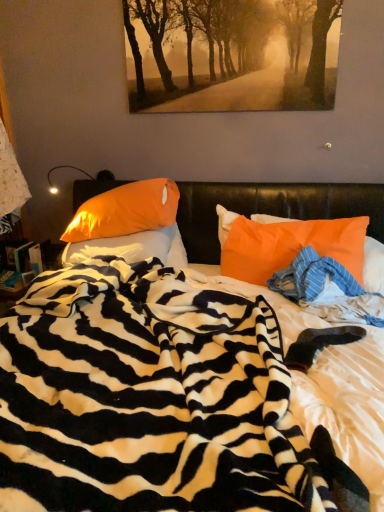
In order to face zebra-patterned blanket at center, should I rotate leftwards or rightwards?

Turn left by 2.061 degrees to look at zebra-patterned blanket at center.

What is the approximate width of golden textured pathway at upper center?

2.22 inches.

Describe the element at coordinates (312, 277) in the screenshot. I see `blue striped fabric at center` at that location.

What is the approximate height of orange satin pillow at center, arranged as the first pillow when viewed from the left?

orange satin pillow at center, arranged as the first pillow when viewed from the left, is 9.42 inches tall.

You are a GUI agent. You are given a task and a screenshot of the screen. Output one action in this format:
    pyautogui.click(x=<x>, y=<y>)
    Task: Click on the orange satin pillow at center, arranged as the first pillow when viewed from the left
    Image resolution: width=384 pixels, height=512 pixels.
    Given the screenshot: What is the action you would take?
    pyautogui.click(x=132, y=248)

At what (x,y) coordinates should I click in order to perform the action: click on zebra-patterned blanket at center. Please return your answer as a coordinate pair (x, y). This screenshot has height=512, width=384. Looking at the image, I should click on (150, 397).

From a real-world perspective, which object stands above the other?

golden textured pathway at upper center.

Is golden textured pathway at upper center smaller than orange fabric pillow at right, which is counted as the third pillow, starting from the left?

Yes, golden textured pathway at upper center is smaller than orange fabric pillow at right, which is counted as the third pillow, starting from the left.

Can you confirm if golden textured pathway at upper center is taller than orange fabric pillow at right, which is counted as the third pillow, starting from the left?

Yes, golden textured pathway at upper center is taller than orange fabric pillow at right, which is counted as the third pillow, starting from the left.

Is golden textured pathway at upper center far from orange fabric pillow at right, acting as the 1th pillow starting from the right?

golden textured pathway at upper center is actually quite close to orange fabric pillow at right, acting as the 1th pillow starting from the right.

Does orange satin pillow at center, which appears as the 3th pillow when viewed from the right, appear on the left side of orange fabric pillow at left, arranged as the 2th pillow when viewed from the left?

Correct, you'll find orange satin pillow at center, which appears as the 3th pillow when viewed from the right, to the left of orange fabric pillow at left, arranged as the 2th pillow when viewed from the left.

Is orange satin pillow at center, which appears as the 3th pillow when viewed from the right, turned away from orange fabric pillow at left, positioned as the 2th pillow in right-to-left order?

orange satin pillow at center, which appears as the 3th pillow when viewed from the right, is not turned away from orange fabric pillow at left, positioned as the 2th pillow in right-to-left order.

Considering the relative positions of orange satin pillow at center, which appears as the 3th pillow when viewed from the right, and orange fabric pillow at left, positioned as the 2th pillow in right-to-left order, in the image provided, is orange satin pillow at center, which appears as the 3th pillow when viewed from the right, in front of orange fabric pillow at left, positioned as the 2th pillow in right-to-left order,?

Yes, orange satin pillow at center, which appears as the 3th pillow when viewed from the right, is closer to the viewer.

Locate an element on the screen. This screenshot has width=384, height=512. pillow that is the 2nd one when counting downward from the orange fabric pillow at left, arranged as the 2th pillow when viewed from the left (from the image's perspective) is located at coordinates (287, 244).

Based on the photo, from the image's perspective, does orange fabric pillow at right, which is counted as the third pillow, starting from the left, appear lower than orange fabric pillow at left, arranged as the 2th pillow when viewed from the left?

Yes, from the image's perspective, orange fabric pillow at right, which is counted as the third pillow, starting from the left, is below orange fabric pillow at left, arranged as the 2th pillow when viewed from the left.

Is orange fabric pillow at right, acting as the 1th pillow starting from the right, thinner than orange fabric pillow at left, arranged as the 2th pillow when viewed from the left?

Indeed, orange fabric pillow at right, acting as the 1th pillow starting from the right, has a lesser width compared to orange fabric pillow at left, arranged as the 2th pillow when viewed from the left.

From a real-world perspective, relative to orange fabric pillow at left, positioned as the 2th pillow in right-to-left order, is orange fabric pillow at right, which is counted as the third pillow, starting from the left, vertically above or below?

orange fabric pillow at right, which is counted as the third pillow, starting from the left, is below orange fabric pillow at left, positioned as the 2th pillow in right-to-left order.

In the scene shown: Is orange fabric pillow at left, positioned as the 2th pillow in right-to-left order, aimed at zebra-patterned blanket at center?

Yes, orange fabric pillow at left, positioned as the 2th pillow in right-to-left order, is turned towards zebra-patterned blanket at center.

From the image's perspective, which is below, orange fabric pillow at left, positioned as the 2th pillow in right-to-left order, or zebra-patterned blanket at center?

zebra-patterned blanket at center is shown below in the image.

Considering the relative positions of orange fabric pillow at left, arranged as the 2th pillow when viewed from the left, and zebra-patterned blanket at center in the image provided, is orange fabric pillow at left, arranged as the 2th pillow when viewed from the left, to the right of zebra-patterned blanket at center from the viewer's perspective?

In fact, orange fabric pillow at left, arranged as the 2th pillow when viewed from the left, is to the left of zebra-patterned blanket at center.

Could you measure the distance between orange fabric pillow at right, acting as the 1th pillow starting from the right, and orange satin pillow at center, arranged as the first pillow when viewed from the left?

A distance of 21.77 inches exists between orange fabric pillow at right, acting as the 1th pillow starting from the right, and orange satin pillow at center, arranged as the first pillow when viewed from the left.

Looking at this image, how different are the orientations of orange fabric pillow at right, acting as the 1th pillow starting from the right, and orange satin pillow at center, which appears as the 3th pillow when viewed from the right, in degrees?

There is a 0.000985-degree angle between the facing directions of orange fabric pillow at right, acting as the 1th pillow starting from the right, and orange satin pillow at center, which appears as the 3th pillow when viewed from the right.

Is the surface of orange fabric pillow at right, acting as the 1th pillow starting from the right, in direct contact with orange satin pillow at center, arranged as the first pillow when viewed from the left?

orange fabric pillow at right, acting as the 1th pillow starting from the right, and orange satin pillow at center, arranged as the first pillow when viewed from the left, are clearly separated.

From their relative heights in the image, would you say orange fabric pillow at right, which is counted as the third pillow, starting from the left, is taller or shorter than orange satin pillow at center, which appears as the 3th pillow when viewed from the right?

In the image, orange fabric pillow at right, which is counted as the third pillow, starting from the left, appears to be taller than orange satin pillow at center, which appears as the 3th pillow when viewed from the right.

From a real-world perspective, between golden textured pathway at upper center and blue striped fabric at center, who is vertically higher?

golden textured pathway at upper center is physically above.

Looking at this image, can you confirm if golden textured pathway at upper center is positioned to the left of blue striped fabric at center?

Indeed, golden textured pathway at upper center is positioned on the left side of blue striped fabric at center.

Does golden textured pathway at upper center turn towards blue striped fabric at center?

No, golden textured pathway at upper center is not facing towards blue striped fabric at center.

Is orange satin pillow at center, which appears as the 3th pillow when viewed from the right, wider than zebra-patterned blanket at center?

Incorrect, the width of orange satin pillow at center, which appears as the 3th pillow when viewed from the right, does not surpass that of zebra-patterned blanket at center.

Find the location of a particular element. bed that is on the right side of orange satin pillow at center, arranged as the first pillow when viewed from the left is located at coordinates (150, 397).

Does point (161, 249) appear closer or farther from the camera than point (189, 301)?

Point (161, 249) is farther from the camera than point (189, 301).

In terms of height, does orange satin pillow at center, arranged as the first pillow when viewed from the left, look taller or shorter compared to zebra-patterned blanket at center?

In the image, orange satin pillow at center, arranged as the first pillow when viewed from the left, appears to be shorter than zebra-patterned blanket at center.

You are a GUI agent. You are given a task and a screenshot of the screen. Output one action in this format:
    pyautogui.click(x=<x>, y=<y>)
    Task: Click on the pillow that appears on the right of golden textured pathway at upper center
    
    Given the screenshot: What is the action you would take?
    pyautogui.click(x=287, y=244)

Where is `the 1st pillow in front of the orange fabric pillow at left, arranged as the 2th pillow when viewed from the left`? the 1st pillow in front of the orange fabric pillow at left, arranged as the 2th pillow when viewed from the left is located at coordinates (132, 248).

From the image, which object appears to be farther from golden textured pathway at upper center, zebra-patterned blanket at center or blue striped fabric at center?

Based on the image, zebra-patterned blanket at center appears to be further to golden textured pathway at upper center.

Which object lies nearer to the anchor point golden textured pathway at upper center, blue striped fabric at center or zebra-patterned blanket at center?

Among the two, blue striped fabric at center is located nearer to golden textured pathway at upper center.

Estimate the real-world distances between objects in this image. Which object is further from blue striped fabric at center, orange satin pillow at center, arranged as the first pillow when viewed from the left, or golden textured pathway at upper center?

golden textured pathway at upper center.

Looking at the image, which one is located closer to zebra-patterned blanket at center, orange satin pillow at center, arranged as the first pillow when viewed from the left, or golden textured pathway at upper center?

orange satin pillow at center, arranged as the first pillow when viewed from the left, is closer to zebra-patterned blanket at center.

Estimate the real-world distances between objects in this image. Which object is closer to orange fabric pillow at left, arranged as the 2th pillow when viewed from the left, orange satin pillow at center, arranged as the first pillow when viewed from the left, or orange fabric pillow at right, acting as the 1th pillow starting from the right?

orange satin pillow at center, arranged as the first pillow when viewed from the left, is positioned closer to the anchor orange fabric pillow at left, arranged as the 2th pillow when viewed from the left.

From the image, which object appears to be farther from golden textured pathway at upper center, orange fabric pillow at left, positioned as the 2th pillow in right-to-left order, or zebra-patterned blanket at center?

Based on the image, zebra-patterned blanket at center appears to be further to golden textured pathway at upper center.

When comparing their distances from zebra-patterned blanket at center, does orange fabric pillow at right, acting as the 1th pillow starting from the right, or blue striped fabric at center seem further?

orange fabric pillow at right, acting as the 1th pillow starting from the right, is positioned further to the anchor zebra-patterned blanket at center.

From the image, which object appears to be farther from orange satin pillow at center, arranged as the first pillow when viewed from the left, blue striped fabric at center or golden textured pathway at upper center?

golden textured pathway at upper center is further to orange satin pillow at center, arranged as the first pillow when viewed from the left.

I want to click on pillow positioned between zebra-patterned blanket at center and orange satin pillow at center, which appears as the 3th pillow when viewed from the right, from near to far, so click(x=287, y=244).

Identify the location of pillow located between zebra-patterned blanket at center and golden textured pathway at upper center in the depth direction. (287, 244).

Where is `material positioned between zebra-patterned blanket at center and orange fabric pillow at left, arranged as the 2th pillow when viewed from the left, from near to far`? material positioned between zebra-patterned blanket at center and orange fabric pillow at left, arranged as the 2th pillow when viewed from the left, from near to far is located at coordinates (312, 277).

This screenshot has height=512, width=384. Identify the location of material positioned between zebra-patterned blanket at center and golden textured pathway at upper center from near to far. (312, 277).